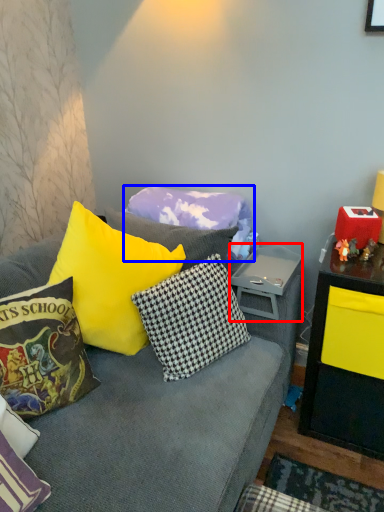
Question: Which of the following is the farthest to the observer, side table (highlighted by a red box) or pillow (highlighted by a blue box)?

Choices:
 (A) side table
 (B) pillow

Answer: (B)